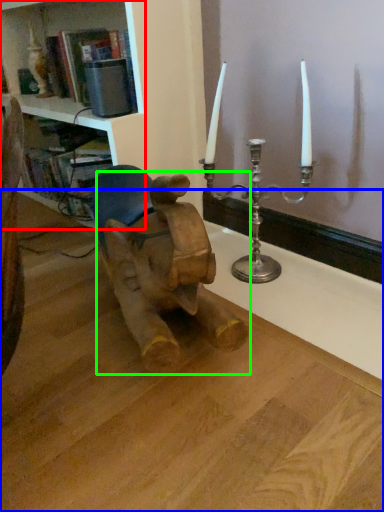
Question: Which object is the farthest from shelf (highlighted by a red box)? Choose among these: table (highlighted by a blue box) or baby elephant (highlighted by a green box).

Choices:
 (A) table
 (B) baby elephant

Answer: (A)